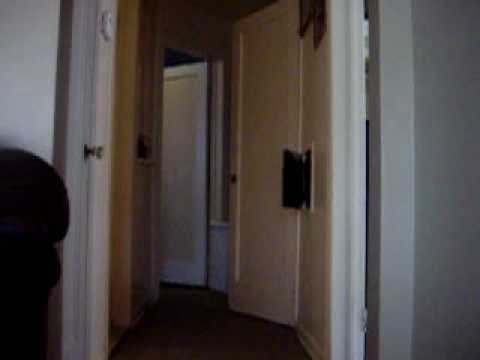
At what (x,y) coordinates should I click in order to perform the action: click on doorknob. Please return your answer as a coordinate pair (x, y). The image size is (480, 360). Looking at the image, I should click on (96, 148).